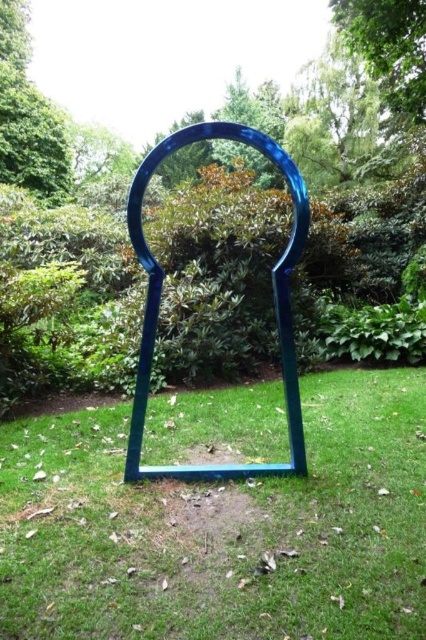
Question: Does green leafy tree at upper center have a smaller size compared to green leafy tree at center?

Choices:
 (A) yes
 (B) no

Answer: (A)

Question: Which point is farther from the camera taking this photo?

Choices:
 (A) (247, 417)
 (B) (247, 161)
 (C) (43, 192)
 (D) (423, 112)

Answer: (B)

Question: Does green leafy tree at upper left have a greater width compared to green leafy tree at upper center?

Choices:
 (A) yes
 (B) no

Answer: (B)

Question: Is green leafy tree at upper center positioned at the back of green leafy tree at center?

Choices:
 (A) yes
 (B) no

Answer: (B)

Question: Among these points, which one is nearest to the camera?

Choices:
 (A) (63, 131)
 (B) (403, 118)
 (C) (262, 120)
 (D) (388, 394)

Answer: (D)

Question: Estimate the real-world distances between objects in this image. Which object is closer to the green leafy tree at upper center?

Choices:
 (A) green leafy tree at center
 (B) green leafy tree at upper left

Answer: (A)